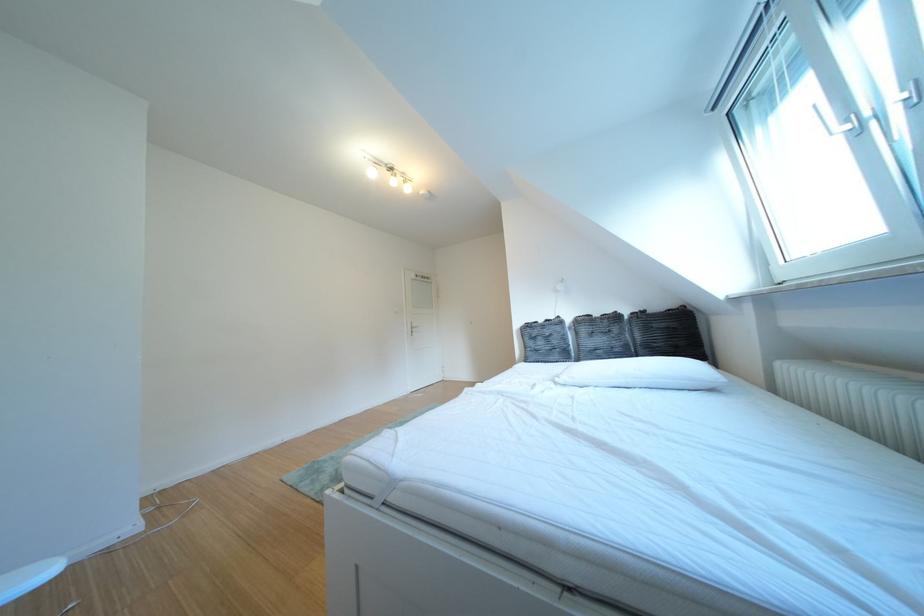
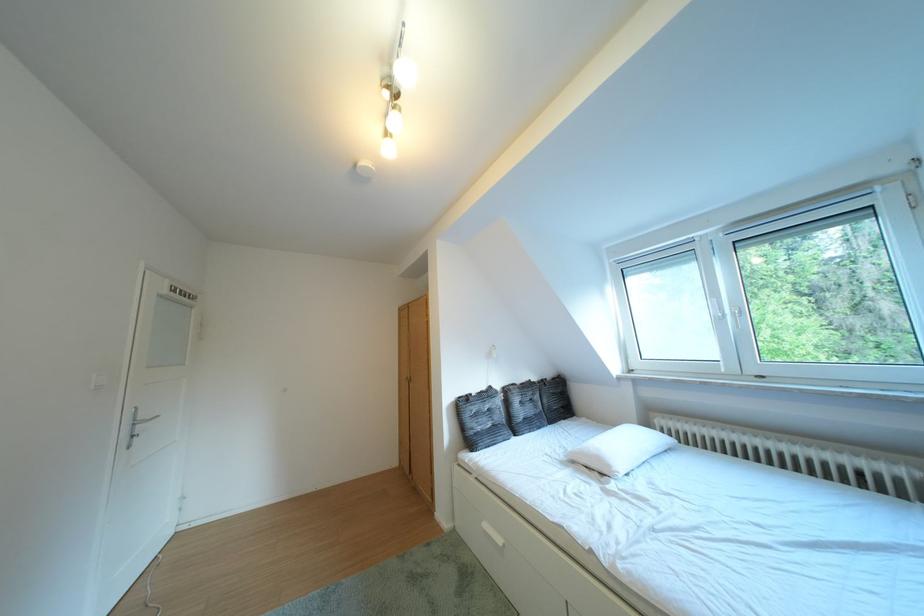
In the second image, find the point that corresponds to the point at 542,355 in the first image.

(484, 438)